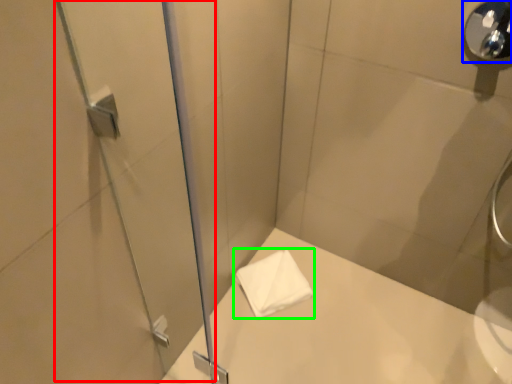
Question: Considering the real-world distances, which object is farthest from screen door (highlighted by a red box)? shower (highlighted by a blue box) or towel (highlighted by a green box)?

Choices:
 (A) shower
 (B) towel

Answer: (A)